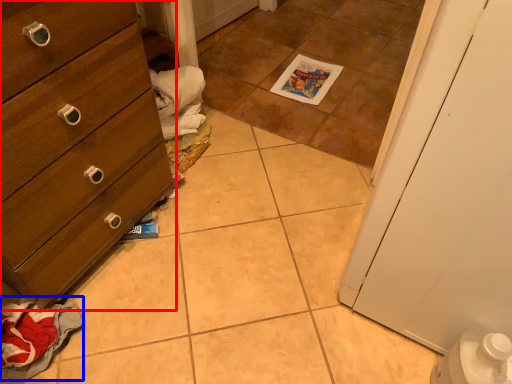
Question: Which of the following is the closest to the observer, chest of drawers (highlighted by a red box) or material (highlighted by a blue box)?

Choices:
 (A) chest of drawers
 (B) material

Answer: (A)